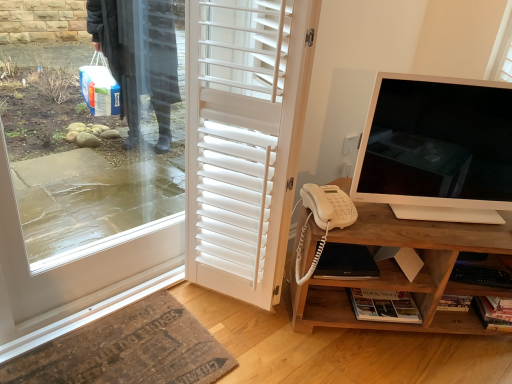
Question: Considering the positions of point (366, 127) and point (325, 271), is point (366, 127) closer or farther from the camera than point (325, 271)?

Choices:
 (A) closer
 (B) farther

Answer: (B)

Question: Would you say white glossy monitor at right is inside or outside black matte laptop at lower center?

Choices:
 (A) inside
 (B) outside

Answer: (B)

Question: Estimate the real-world distances between objects in this image. Which object is closer to the rug at lower left?

Choices:
 (A) black matte laptop at lower center
 (B) white matte door at center
 (C) white glossy monitor at right
 (D) wooden cabinet at right

Answer: (B)

Question: Considering the real-world distances, which object is farthest from the black matte laptop at lower center?

Choices:
 (A) rug at lower left
 (B) wooden cabinet at right
 (C) white matte door at center
 (D) white glossy monitor at right

Answer: (A)